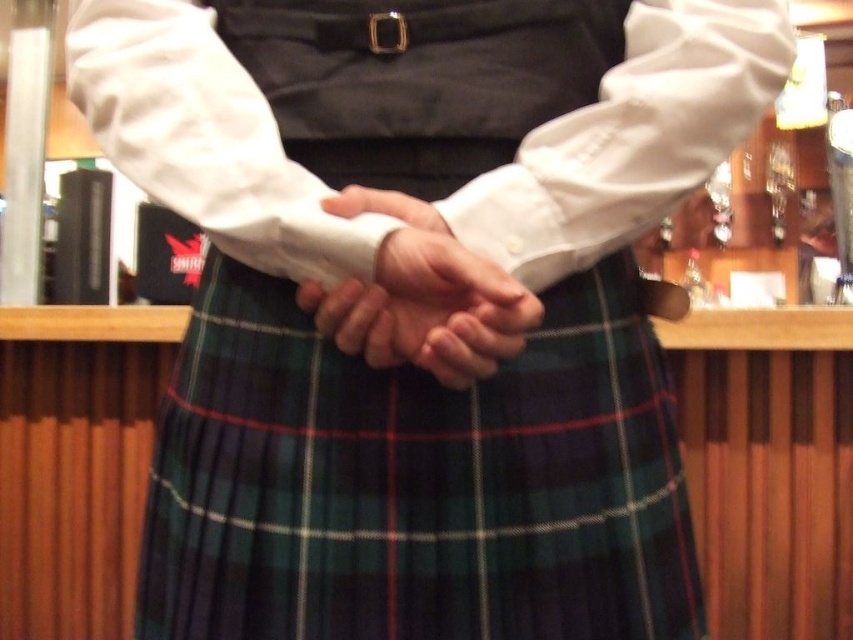
Looking at this image, you are a bartender at the bar in the scene. You need to reach for a bottle located behind the white smooth shirt at center and the white matte shirt at center. Which shirt should you move first to access the bottle?

The white smooth shirt at center is above the white matte shirt at center, so you should move the white smooth shirt at center first to access the bottle.

You are a photographer taking a portrait of the person in the scene. You want to ensure that both the green plaid kilt at center and the white matte shirt at center are clearly visible in the frame. Based on their positions, which object should you focus on first to ensure both are in focus?

The green plaid kilt at center is to the left of the white matte shirt at center, so focusing on the green plaid kilt at center first will help ensure both are in focus since it is closer to the left edge of the frame.

You are a photographer standing at the front of the bar. You want to take a photo of the green plaid kilt at center. Where should you position yourself to capture the kilt in the center of the photo?

To capture the green plaid kilt at center in the center of the photo, position yourself directly in front of the kilt since its 2D location is at point (416, 481), which is the center of the image.